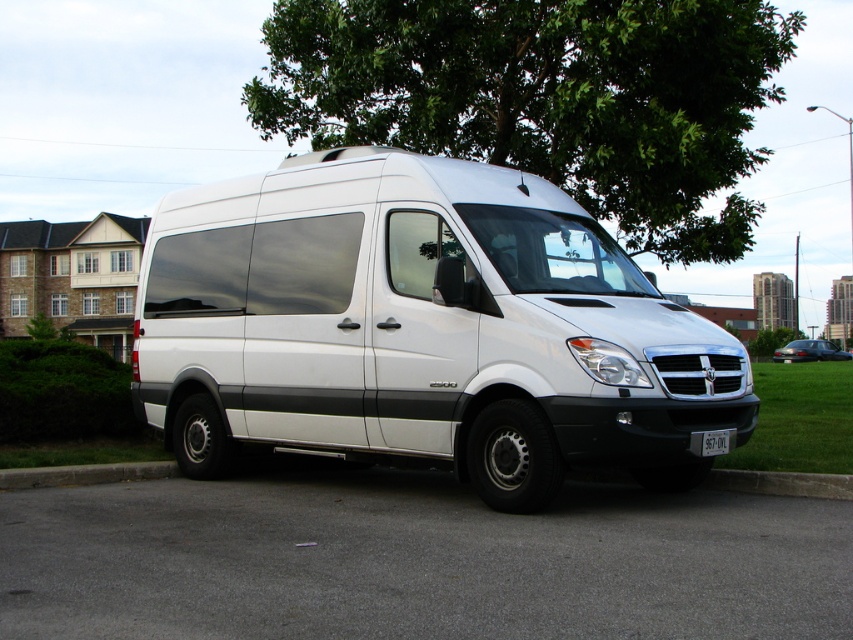
Question: Among these points, which one is nearest to the camera?

Choices:
 (A) (827, 476)
 (B) (804, 477)
 (C) (387, 81)

Answer: (A)

Question: Can you confirm if green leafy tree at upper center is positioned to the left of concrete at lower center?

Choices:
 (A) yes
 (B) no

Answer: (B)

Question: Can you confirm if concrete at lower center is thinner than gray concrete curb at lower right?

Choices:
 (A) no
 (B) yes

Answer: (A)

Question: Which object is closer to the camera taking this photo?

Choices:
 (A) gray concrete curb at lower right
 (B) white plastic license plate at center
 (C) gray concrete curb at lower left
 (D) concrete at lower center

Answer: (B)

Question: Does gray concrete curb at lower right have a larger size compared to white plastic license plate at center?

Choices:
 (A) no
 (B) yes

Answer: (B)

Question: Which object is positioned farthest from the white matte van at center?

Choices:
 (A) gray concrete curb at lower left
 (B) gray concrete curb at lower right

Answer: (A)